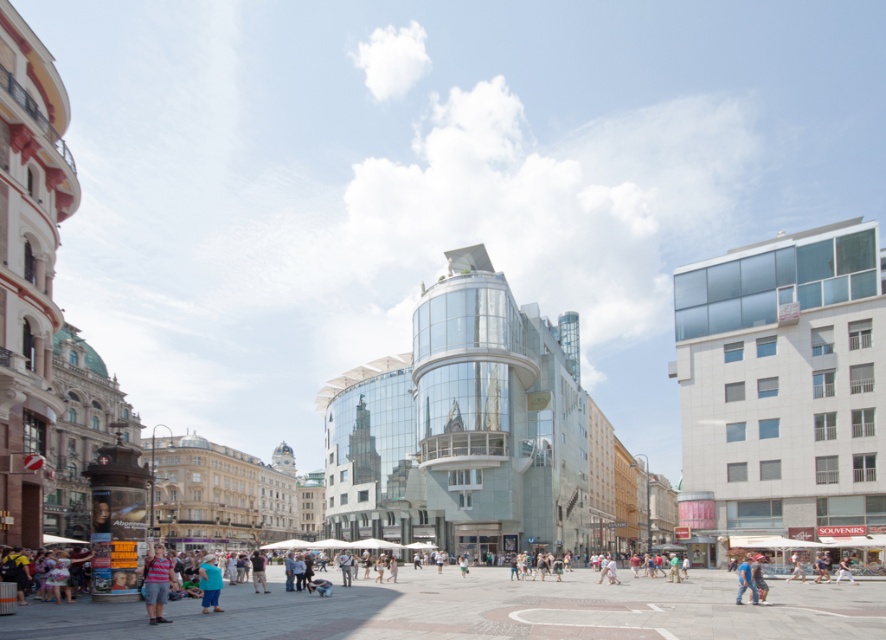
Can you confirm if striped cotton shirt at lower center is positioned above blue denim jeans at center?

Yes, striped cotton shirt at lower center is above blue denim jeans at center.

Does striped cotton shirt at lower center have a larger size compared to blue denim jeans at center?

Actually, striped cotton shirt at lower center might be smaller than blue denim jeans at center.

The width and height of the screenshot is (886, 640). I want to click on striped cotton shirt at lower center, so click(x=157, y=582).

Where is `striped cotton shirt at lower center`? striped cotton shirt at lower center is located at coordinates (157, 582).

Is blue fabric pants at lower left below blue denim jeans at center?

Indeed, blue fabric pants at lower left is positioned under blue denim jeans at center.

Is blue fabric pants at lower left thinner than blue denim jeans at center?

No, blue fabric pants at lower left is not thinner than blue denim jeans at center.

Locate an element on the screen. Image resolution: width=886 pixels, height=640 pixels. blue fabric pants at lower left is located at coordinates (208, 582).

Locate an element on the screen. blue fabric pants at lower left is located at coordinates (208, 582).

Can you confirm if striped cotton shirt at lower center is shorter than blue fabric pants at lower left?

Indeed, striped cotton shirt at lower center has a lesser height compared to blue fabric pants at lower left.

Describe the element at coordinates (157, 582) in the screenshot. I see `striped cotton shirt at lower center` at that location.

Where is `striped cotton shirt at lower center`? striped cotton shirt at lower center is located at coordinates (157, 582).